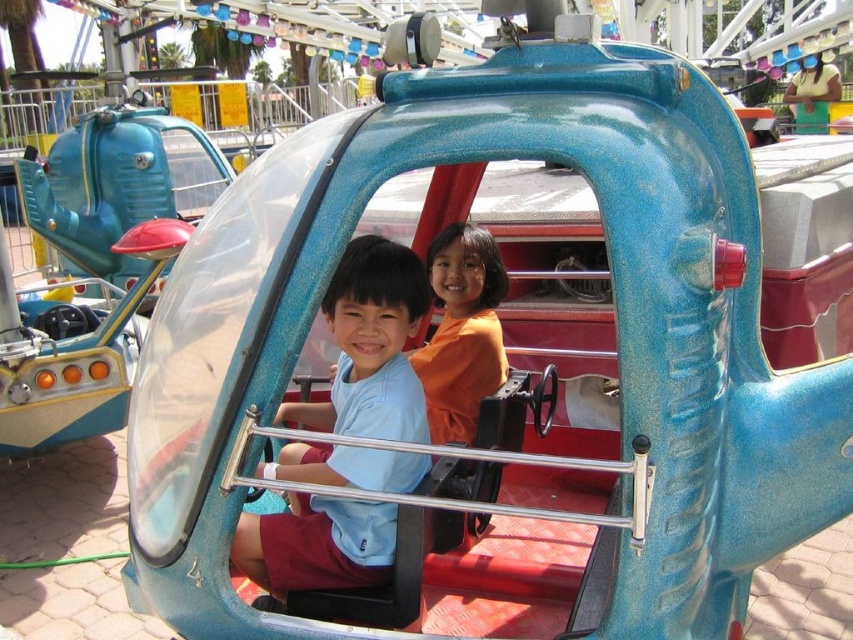
Question: Is matte blue shirt at center wider than orange matte shirt at center?

Choices:
 (A) yes
 (B) no

Answer: (A)

Question: Which object appears farthest from the camera in this image?

Choices:
 (A) matte blue shirt at center
 (B) orange matte shirt at center

Answer: (B)

Question: Does matte blue shirt at center appear over orange matte shirt at center?

Choices:
 (A) yes
 (B) no

Answer: (B)

Question: From the image, what is the correct spatial relationship of matte blue shirt at center in relation to orange matte shirt at center?

Choices:
 (A) right
 (B) left

Answer: (B)